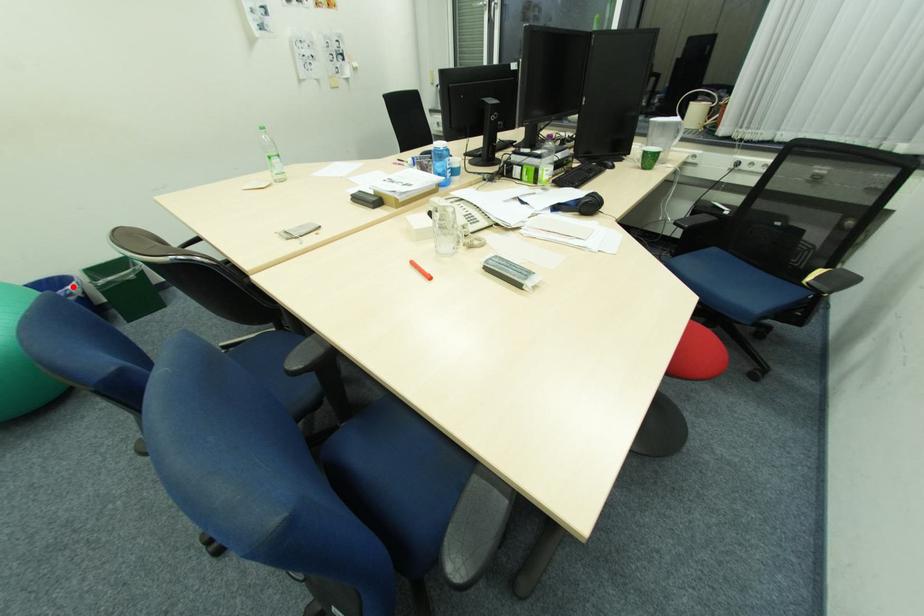
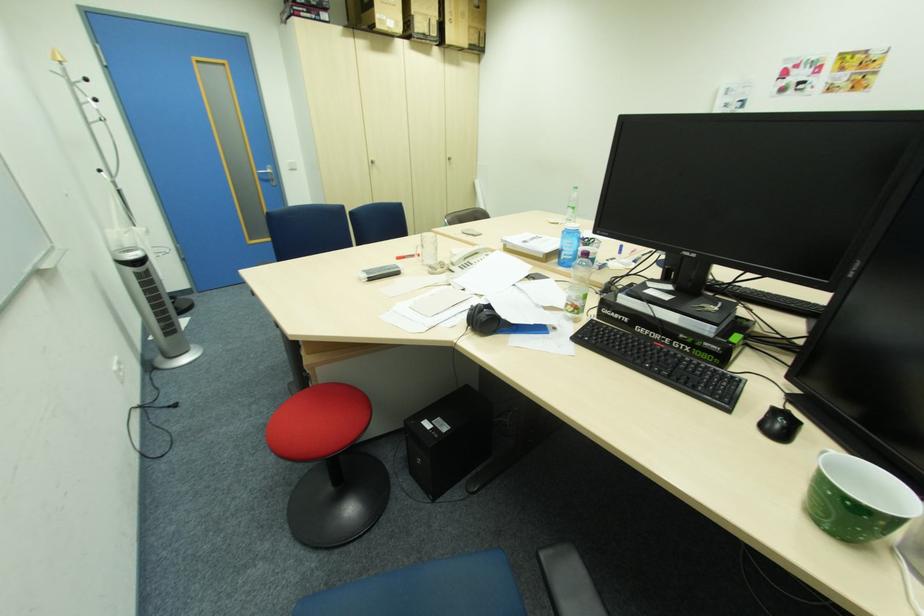
Question: I am providing you with two images of the same scene from different viewpoints. A red point is marked on the first image. Can you still see the location of the red point in image 2?

Choices:
 (A) Yes
 (B) No

Answer: (B)